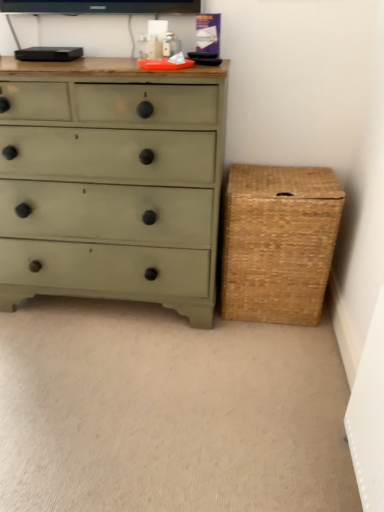
Question: Is woven brown basket at right in front of or behind matte green chest of drawers at left in the image?

Choices:
 (A) behind
 (B) front

Answer: (A)

Question: Based on their sizes in the image, would you say woven brown basket at right is bigger or smaller than matte green chest of drawers at left?

Choices:
 (A) small
 (B) big

Answer: (A)

Question: Does point (258, 224) appear closer or farther from the camera than point (190, 286)?

Choices:
 (A) closer
 (B) farther

Answer: (A)

Question: Is matte green chest of drawers at left wider or thinner than woven brown basket at right?

Choices:
 (A) thin
 (B) wide

Answer: (B)

Question: From the image's perspective, is matte green chest of drawers at left above or below woven brown basket at right?

Choices:
 (A) above
 (B) below

Answer: (A)

Question: Considering the positions of point (51, 161) and point (297, 181), is point (51, 161) closer or farther from the camera than point (297, 181)?

Choices:
 (A) farther
 (B) closer

Answer: (B)

Question: Is matte green chest of drawers at left taller or shorter than woven brown basket at right?

Choices:
 (A) short
 (B) tall

Answer: (B)